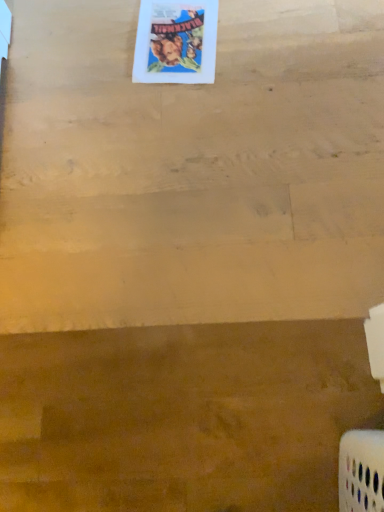
At what (x,y) coordinates should I click in order to perform the action: click on free space that is to the left of matte paper comic book at upper center. Please return your answer as a coordinate pair (x, y). Looking at the image, I should click on point(93,60).